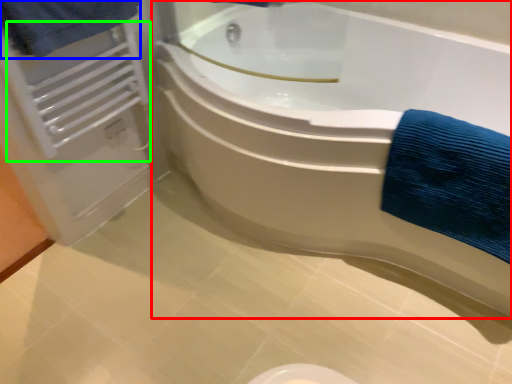
Question: Considering the real-world distances, which object is farthest from bathtub (highlighted by a red box)? bath towel (highlighted by a blue box) or radiator (highlighted by a green box)?

Choices:
 (A) bath towel
 (B) radiator

Answer: (A)